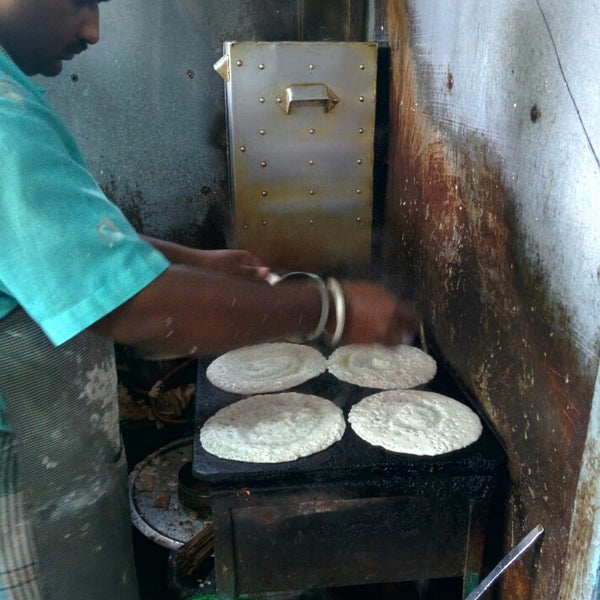
Find the location of `maybe chimney`. maybe chimney is located at coordinates (297, 180).